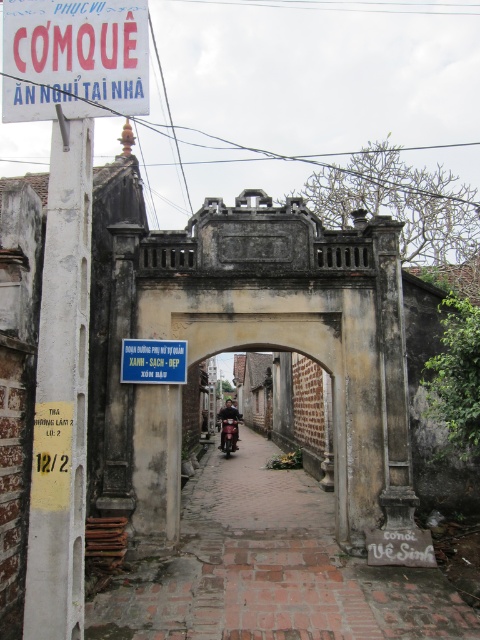
Based on the photo, how much distance is there between red plastic sign at upper left and metallic red motorbike at center?

red plastic sign at upper left and metallic red motorbike at center are 20.63 meters apart from each other.

Can you confirm if red plastic sign at upper left is wider than metallic red motorbike at center?

Yes, red plastic sign at upper left is wider than metallic red motorbike at center.

The width and height of the screenshot is (480, 640). I want to click on red plastic sign at upper left, so point(74,58).